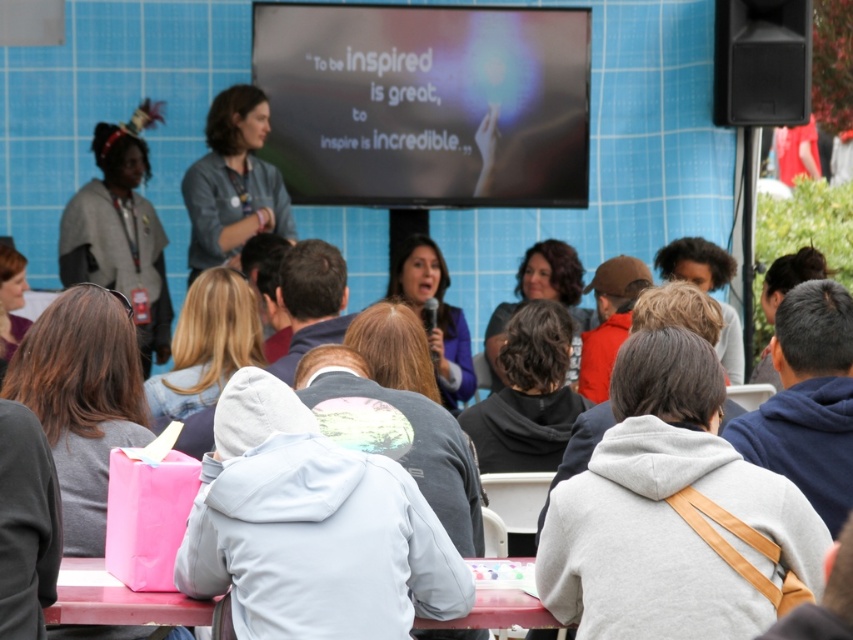
Which is above, gray hoodie at center or pink plastic table at lower center?

gray hoodie at center is higher up.

Does gray hoodie at center have a lesser height compared to pink plastic table at lower center?

No.

Identify the location of gray hoodie at center. Image resolution: width=853 pixels, height=640 pixels. (799, 438).

Find the location of a particular element. The width and height of the screenshot is (853, 640). gray hoodie at center is located at coordinates (799, 438).